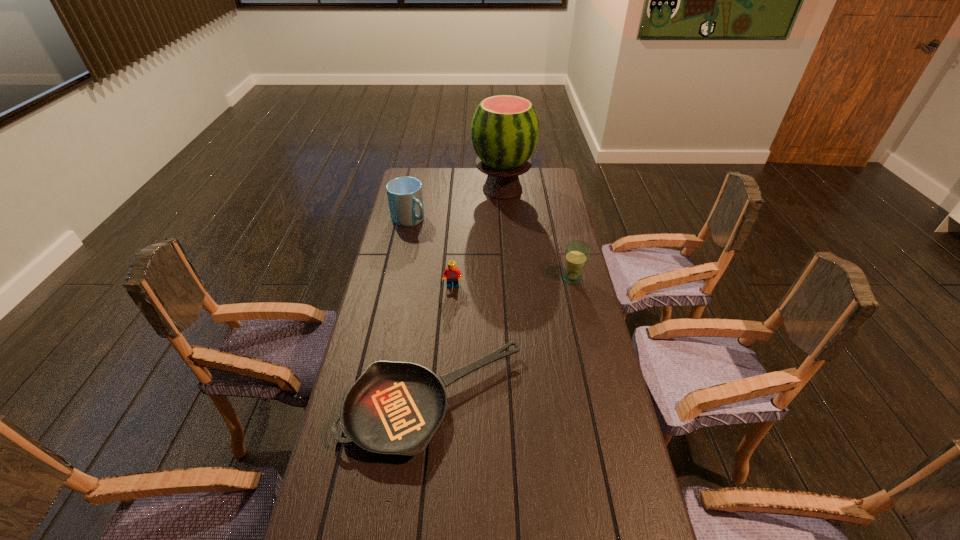
Identify the location of the closest object to the second farthest object. The height and width of the screenshot is (540, 960). click(x=505, y=129).

The width and height of the screenshot is (960, 540). In order to click on object that is the closest to the watermelon in this screenshot , I will do `click(405, 197)`.

Where is `vacant position in the image that satisfies the following two spatial constraints: 1. on the front side of the nearest object; 2. on the left side of the second farthest object`? vacant position in the image that satisfies the following two spatial constraints: 1. on the front side of the nearest object; 2. on the left side of the second farthest object is located at coordinates (372, 401).

This screenshot has width=960, height=540. Identify the location of free spot that satisfies the following two spatial constraints: 1. on the front side of the nearest object; 2. on the left side of the mug. (372, 401).

In order to click on free region that satisfies the following two spatial constraints: 1. on the front side of the mug; 2. on the left side of the glass in this screenshot , I will do `click(397, 279)`.